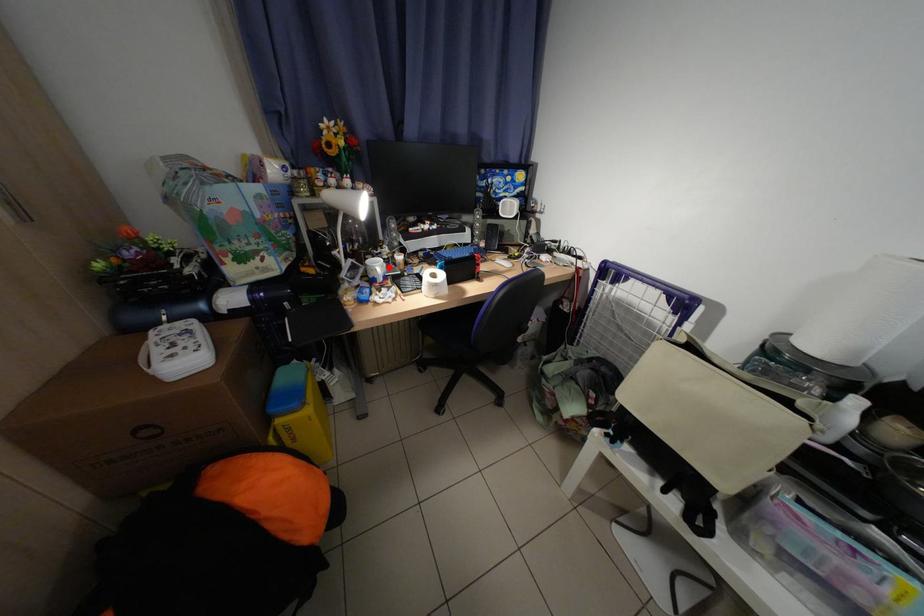
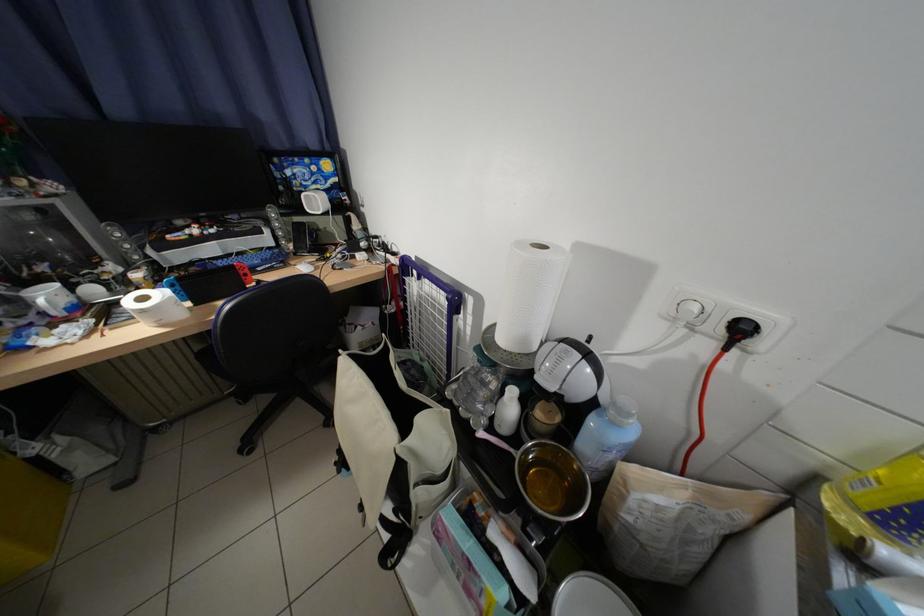
Question: I am providing you with two images of the same scene from different viewpoints. A red point is shown in image1. For the corresponding object point in image2, is it positioned nearer or farther from the camera?

Choices:
 (A) Nearer
 (B) Farther

Answer: (B)